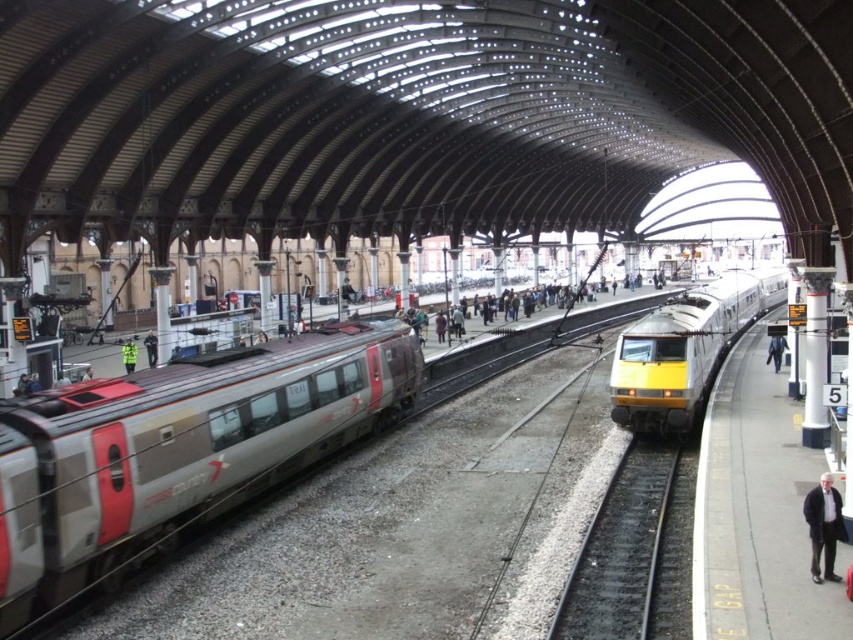
You are standing at the point marked as point (196,493) in the train station. The train is approaching the platform. If the train is currently 15.62 meters away from you, will it pass directly in front of you or behind you?

The point (196,493) is 15.62 meters away from the viewer. Since the train is approaching the platform and the distance matches exactly, the train will pass directly in front of you.